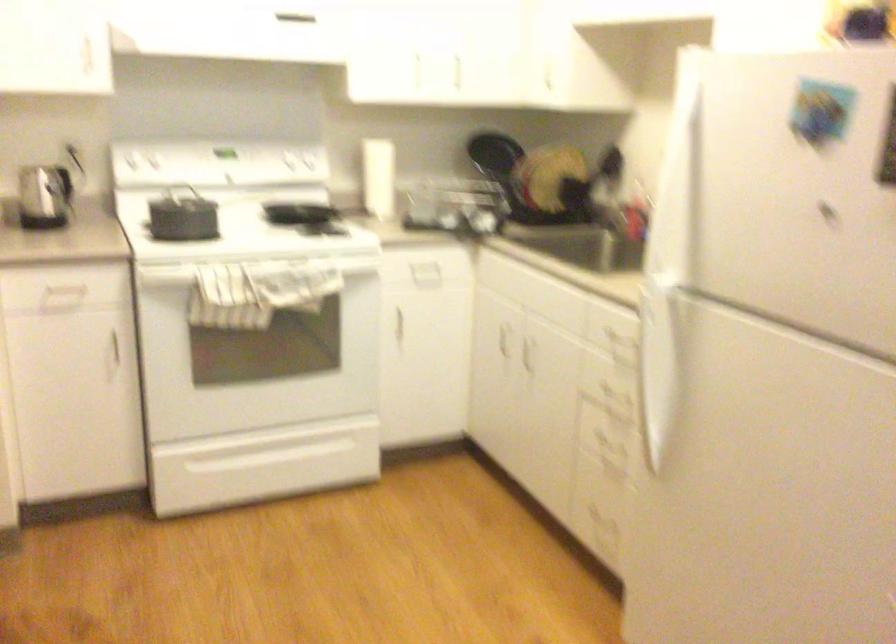
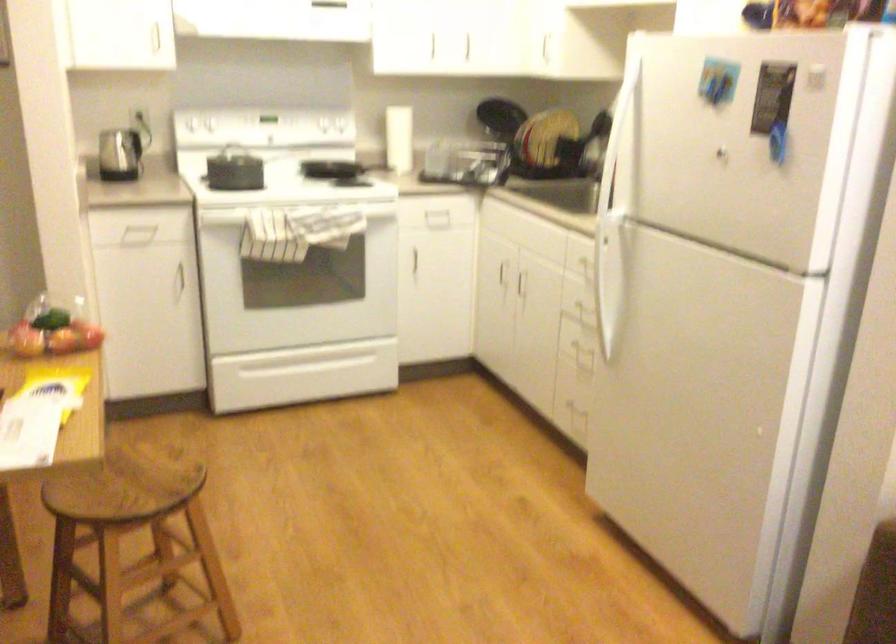
In the second image, find the point that corresponds to (x=85, y=176) in the first image.

(149, 131)